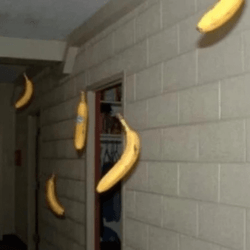
Locate an element on the screen. This screenshot has width=250, height=250. shelves in a closet is located at coordinates (104, 127), (106, 97).